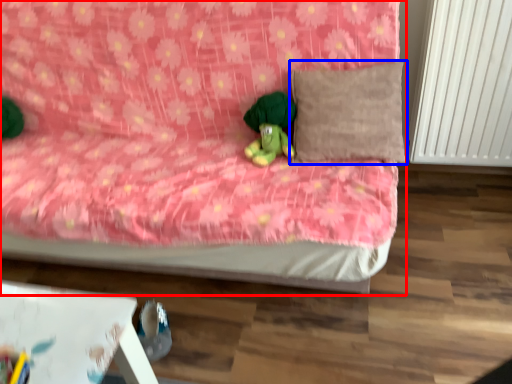
Question: Which of the following is the farthest to the observer, bed (highlighted by a red box) or pillow (highlighted by a blue box)?

Choices:
 (A) bed
 (B) pillow

Answer: (B)